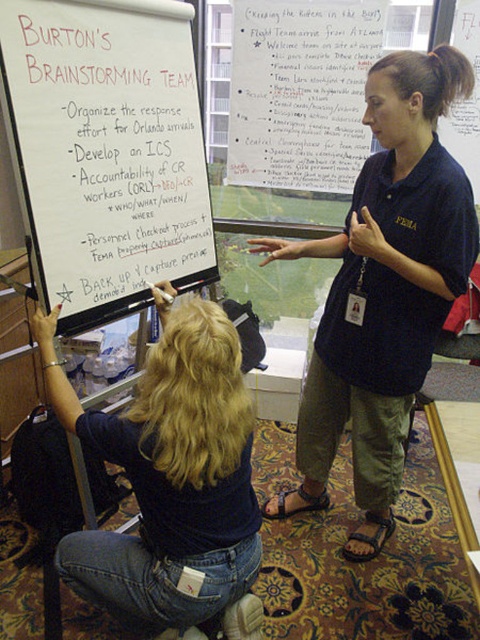
You are a project manager standing in the room where the brainstorming session is happening. You need to reach a point that is exactly 5 feet away from you to retrieve a document. Is the point labeled as point (4,49) within your reach?

The point labeled as point (4,49) is 4.96 feet away from the viewer, which is within the 5 feet reach required to retrieve the document.

Based on the scene description, which object is positioned higher in the image, the dark blue shirt at center or the denim jeans at lower left?

The dark blue shirt at center is positioned higher than the denim jeans at lower left in the image.

You are a new team member entering the room and need to approach the whiteboard at upper left and the denim jeans at lower left. Which object will you encounter first as you walk into the room?

You will encounter the whiteboard at upper left first because it is closer to you than the denim jeans at lower left, which is further away.